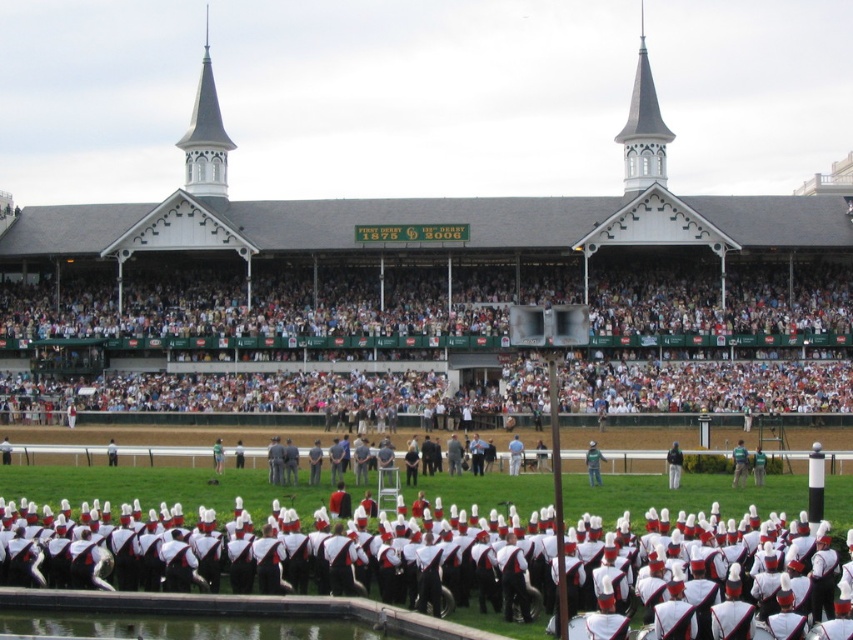
Looking at this image, you are a photographer standing at the front of the grandstand. You want to take a photo that includes both the point at coordinates point [590,396] and point [123,552]. Which point is closer to the camera so that you can focus on it first?

Point [123,552] is closer to the camera than point [590,396], so you should focus on point [123,552] first.